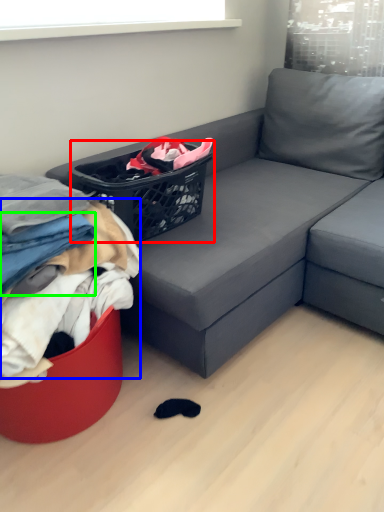
Question: Based on their relative distances, which object is farther from basket (highlighted by a red box)? Choose from clothing (highlighted by a blue box) and clothing (highlighted by a green box).

Choices:
 (A) clothing
 (B) clothing

Answer: (B)